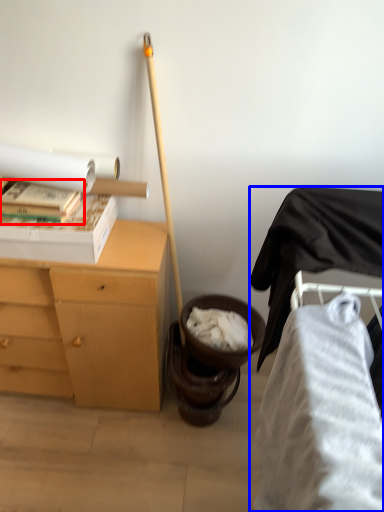
Question: Among these objects, which one is farthest to the camera, book (highlighted by a red box) or furniture (highlighted by a blue box)?

Choices:
 (A) book
 (B) furniture

Answer: (A)